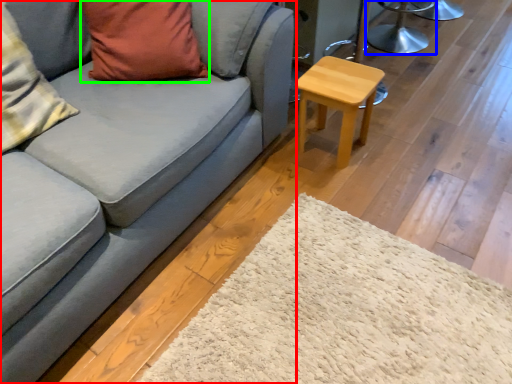
Question: Which object is the farthest from studio couch (highlighted by a red box)? Choose among these: swivel chair (highlighted by a blue box) or pillow (highlighted by a green box).

Choices:
 (A) swivel chair
 (B) pillow

Answer: (A)